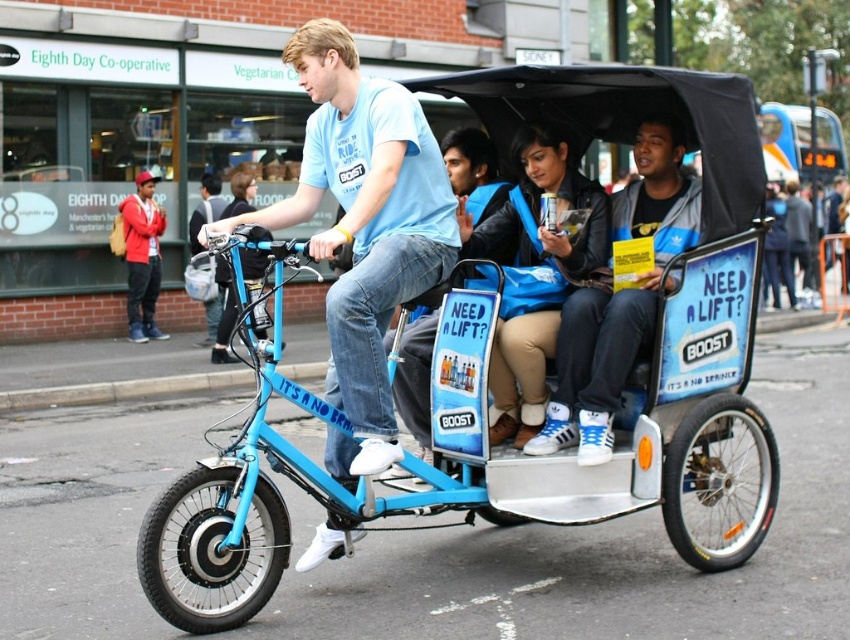
You are a passenger waiting to board the tricycle taxi. The driver tells you to stand at point A, which is point (602, 515). However, there is another passenger already standing at point B, which is point (374, 292). To ensure safety, you must not stand in front of the other passenger. Which point should you choose to stand at?

You should stand at point (602, 515) because it is behind point (374, 292), so you won not block the other passenger.

You are a delivery person needing to place a small package on the blue matte tricycle at center or the blue leather jacket at center. Which object can accommodate the package without it falling off due to width constraints?

Result: The blue matte tricycle at center has a greater width than the blue leather jacket at center, so the package can be placed on the blue matte tricycle at center without falling off due to width constraints.

You are a passenger waiting to board the matte blue bicycle at center. The driver tells you to sit on the blue leather jacket at center. Which side of the bicycle should you walk around to reach the jacket?

The matte blue bicycle at center is to the left of the blue leather jacket at center, so you should walk around the right side of the matte blue bicycle at center to reach the blue leather jacket at center.